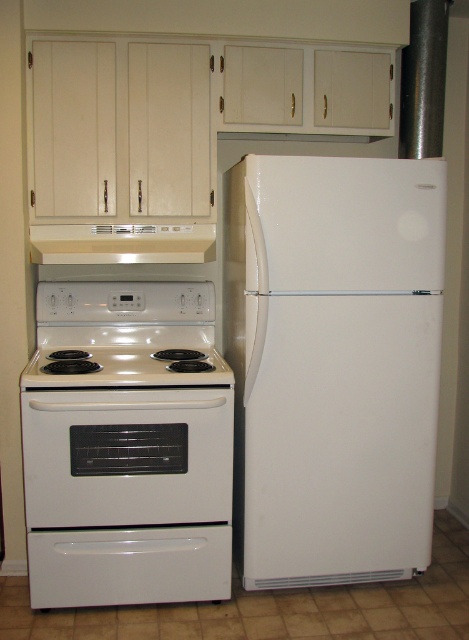
Is point (108, 392) positioned behind point (188, 236)?

No.

Is white glossy electric stove at lower left shorter than beige plastic exhaust hood at upper center?

Incorrect, white glossy electric stove at lower left's height does not fall short of beige plastic exhaust hood at upper center's.

Based on the photo, who is more forward, (36, 396) or (194, 241)?

Positioned in front is point (36, 396).

Where is `white glossy electric stove at lower left`? This screenshot has width=469, height=640. white glossy electric stove at lower left is located at coordinates (127, 445).

Is white glossy refrigerator at center wider than beige plastic exhaust hood at upper center?

Correct, the width of white glossy refrigerator at center exceeds that of beige plastic exhaust hood at upper center.

Is white glossy refrigerator at center thinner than beige plastic exhaust hood at upper center?

In fact, white glossy refrigerator at center might be wider than beige plastic exhaust hood at upper center.

The width and height of the screenshot is (469, 640). I want to click on white glossy refrigerator at center, so click(x=332, y=364).

Does beige plastic exhaust hood at upper center have a lesser width compared to white glossy electric stove at center?

Yes, beige plastic exhaust hood at upper center is thinner than white glossy electric stove at center.

Describe the element at coordinates (121, 243) in the screenshot. I see `beige plastic exhaust hood at upper center` at that location.

In order to click on beige plastic exhaust hood at upper center in this screenshot , I will do `click(121, 243)`.